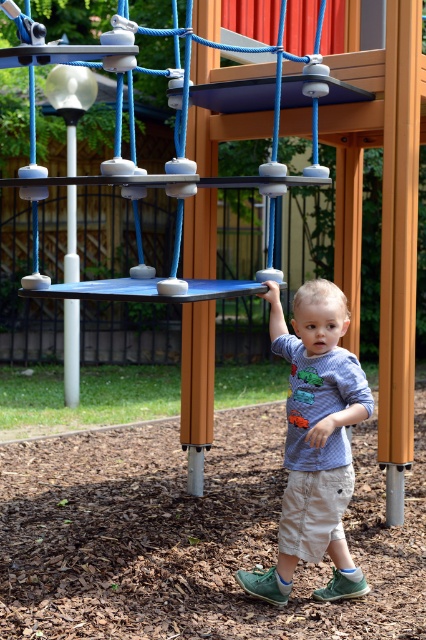
From the picture: You are a parent at the playground and want to ensure your child can comfortably wear their blue cotton shirt at center while swinging on the blue rubber swing at center. Based on the size comparison between the two, will the shirt fit without any issues?

The blue cotton shirt at center has a smaller width than the blue rubber swing at center, so the shirt should fit comfortably without any issues while swinging.

You are a photographer trying to capture the child in the center of the image. The blue cotton shirt at center is represented by point (314, 442). Where should you focus your camera to ensure the child is centered?

To center the child, focus your camera on the point (314, 442) where the blue cotton shirt at center is located.

You are a parent at the playground and see the blue cotton shirt at center and the blue rubber swing at center. Which item is larger?

The blue rubber swing at center is larger than the blue cotton shirt at center.